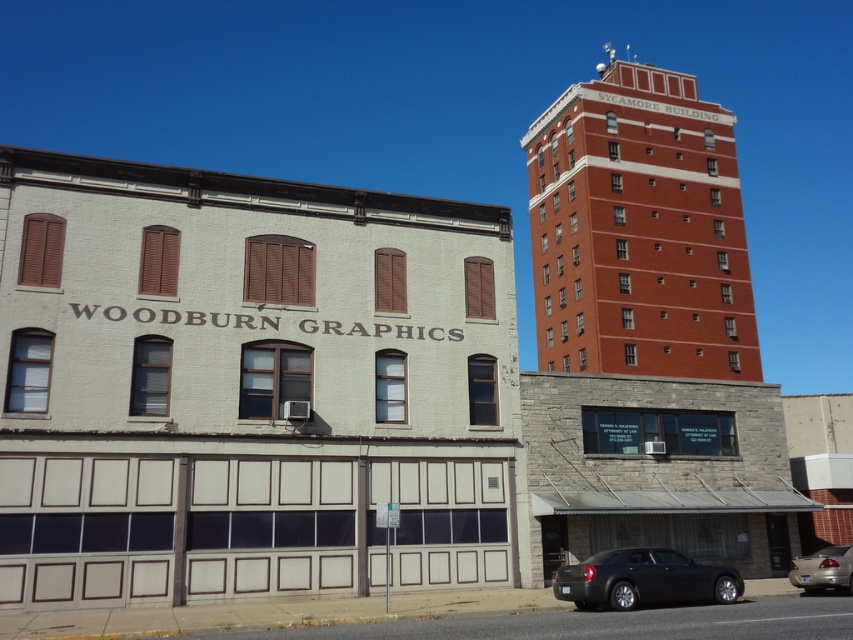
Question: Considering the real-world distances, which object is closest to the black matte sedan at lower center?

Choices:
 (A) brick building at upper right
 (B) matte black sedan at lower right

Answer: (B)

Question: Which point is closer to the camera?

Choices:
 (A) (569, 84)
 (B) (838, 570)

Answer: (B)

Question: In this image, where is brick building at upper right located relative to matte black sedan at lower right?

Choices:
 (A) below
 (B) above

Answer: (B)

Question: Is brick building at upper right below black matte sedan at lower center?

Choices:
 (A) yes
 (B) no

Answer: (B)

Question: Which object appears farthest from the camera in this image?

Choices:
 (A) matte black sedan at lower right
 (B) brick building at upper right

Answer: (B)

Question: Can you confirm if brick building at upper right is positioned above black matte sedan at lower center?

Choices:
 (A) yes
 (B) no

Answer: (A)